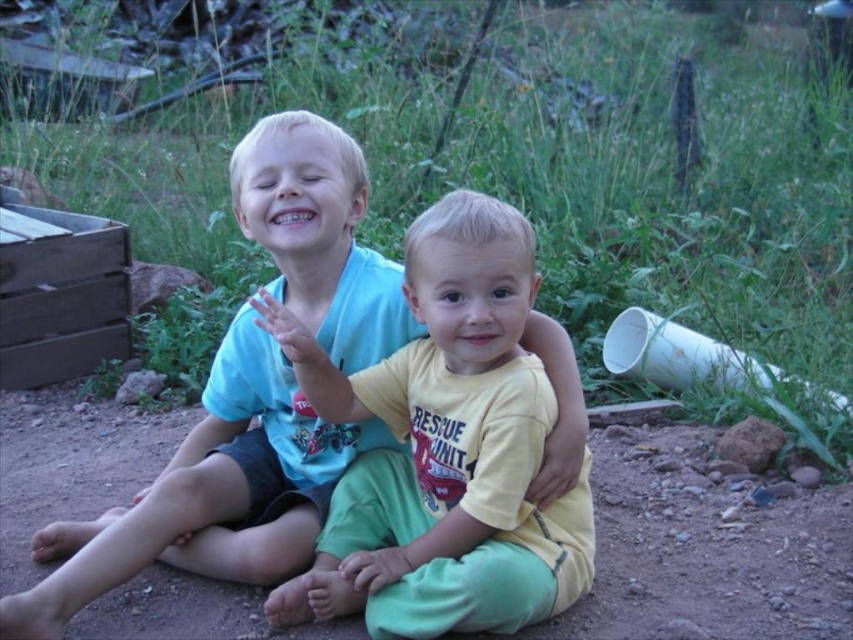
Does point (341, 256) come in front of point (573, 611)?

No, it is not.

Where is `matte blue shirt at center`? The width and height of the screenshot is (853, 640). matte blue shirt at center is located at coordinates (209, 493).

Measure the distance between point [579,500] and camera.

The distance of point [579,500] from camera is 5.89 feet.

Can you confirm if yellow cotton shirt at center is thinner than brown dirt at center?

Indeed, yellow cotton shirt at center has a lesser width compared to brown dirt at center.

Image resolution: width=853 pixels, height=640 pixels. What do you see at coordinates (444, 449) in the screenshot?
I see `yellow cotton shirt at center` at bounding box center [444, 449].

Locate an element on the screen. This screenshot has width=853, height=640. yellow cotton shirt at center is located at coordinates (444, 449).

Who is positioned more to the left, yellow cotton shirt at center or matte blue shirt at center?

matte blue shirt at center is more to the left.

Is point (525, 474) positioned before point (584, 428)?

That is True.

Which is behind, point (387, 570) or point (544, 339)?

Point (544, 339)

Identify the location of yellow cotton shirt at center. The width and height of the screenshot is (853, 640). (444, 449).